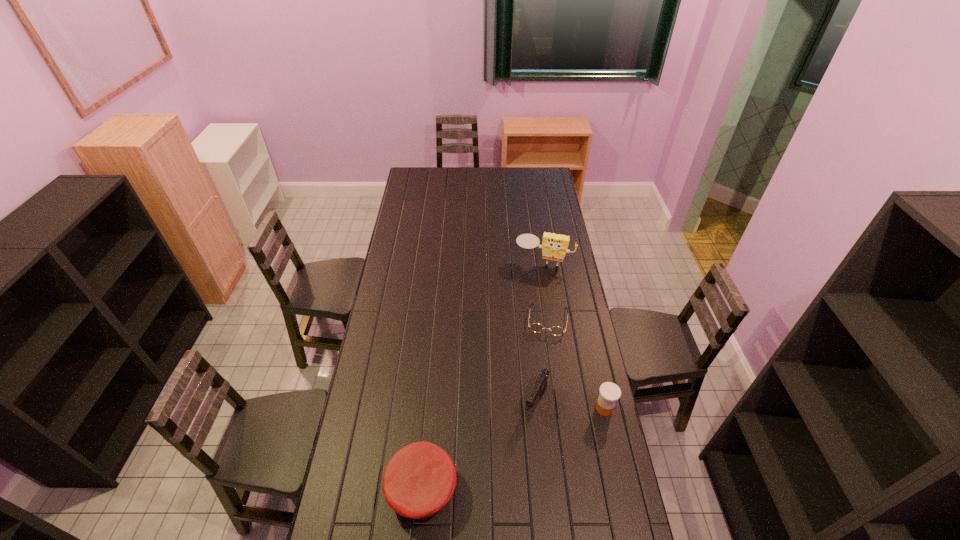
You are a GUI agent. You are given a task and a screenshot of the screen. Output one action in this format:
    pyautogui.click(x=<x>, y=<y>)
    Task: Click on the vacant space located 0.270m on the label of the medicine
    
    Given the screenshot: What is the action you would take?
    pyautogui.click(x=522, y=408)

This screenshot has height=540, width=960. What are the coordinates of `vacant area situated on the label of the medicine` in the screenshot? It's located at (503, 408).

Find the location of a particular element. This screenshot has height=540, width=960. vacant area situated on the label of the medicine is located at coordinates (573, 408).

Locate an element on the screen. This screenshot has width=960, height=540. vacant space situated on the lenses of the shortest object is located at coordinates (542, 363).

This screenshot has height=540, width=960. I want to click on vacant region located on the lenses of the shortest object, so click(x=541, y=372).

The height and width of the screenshot is (540, 960). Find the location of `free space located 0.260m on the lenses of the shortest object`. free space located 0.260m on the lenses of the shortest object is located at coordinates (540, 388).

This screenshot has width=960, height=540. I want to click on vacant area situated on the front-facing side of the tallest object, so click(x=521, y=329).

At what (x,y) coordinates should I click in order to perform the action: click on free spot located on the front-facing side of the tallest object. Please return your answer as a coordinate pair (x, y). Looking at the image, I should click on (529, 299).

At what (x,y) coordinates should I click in order to perform the action: click on vacant area located 0.200m on the front-facing side of the tallest object. Please return your answer as a coordinate pair (x, y). This screenshot has height=540, width=960. Looking at the image, I should click on click(x=529, y=299).

This screenshot has width=960, height=540. I want to click on free region located at the barrel of the pistol, so click(507, 470).